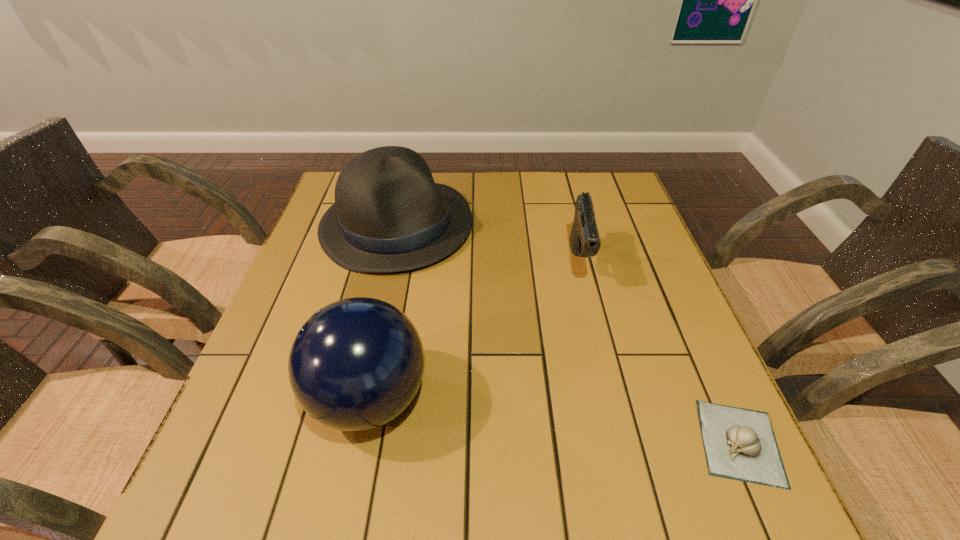
Identify the location of object at the right edge. [x=740, y=444].

The height and width of the screenshot is (540, 960). I want to click on object that is positioned at the far left corner, so click(x=389, y=215).

Where is `object that is at the near left corner`? This screenshot has height=540, width=960. object that is at the near left corner is located at coordinates (356, 364).

Find the location of a particular element. object located in the near right corner section of the desktop is located at coordinates (740, 444).

This screenshot has width=960, height=540. In the image, there is a desktop. What are the coordinates of `vacant space at the far edge` in the screenshot? It's located at (525, 180).

Image resolution: width=960 pixels, height=540 pixels. I want to click on vacant space at the left edge of the desktop, so click(x=294, y=318).

The image size is (960, 540). What are the coordinates of `vacant space at the right edge of the desktop` in the screenshot? It's located at (619, 245).

In the image, there is a desktop. Identify the location of vacant space at the far right corner. (591, 191).

This screenshot has width=960, height=540. Identify the location of free spot between the second object from right to left and the bowling ball. (474, 330).

Find the location of `free space between the garlic and the bowling ball`. free space between the garlic and the bowling ball is located at coordinates coord(555,421).